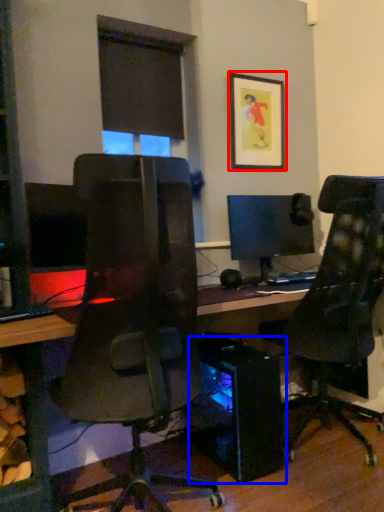
Question: Which object is closer to the camera taking this photo, picture frame (highlighted by a red box) or computer tower (highlighted by a blue box)?

Choices:
 (A) picture frame
 (B) computer tower

Answer: (B)